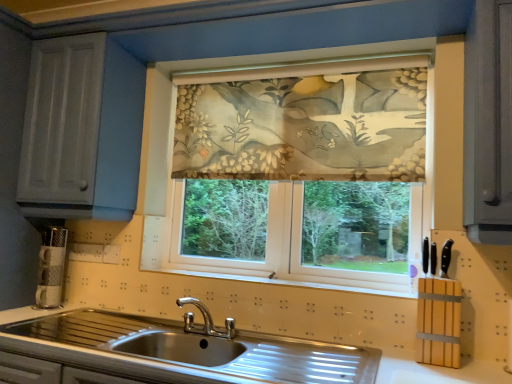
Question: Is stainless steel sink at lower center in front of or behind floral fabric curtain at center in the image?

Choices:
 (A) behind
 (B) front

Answer: (B)

Question: Do you think stainless steel sink at lower center is within floral fabric curtain at center, or outside of it?

Choices:
 (A) outside
 (B) inside

Answer: (A)

Question: Which of these objects is positioned closest to the floral fabric curtain at center?

Choices:
 (A) stainless steel sink at lower center
 (B) floral fabric at center

Answer: (B)

Question: Considering the real-world distances, which object is closest to the floral fabric curtain at center?

Choices:
 (A) floral fabric at center
 (B) stainless steel sink at lower center

Answer: (A)